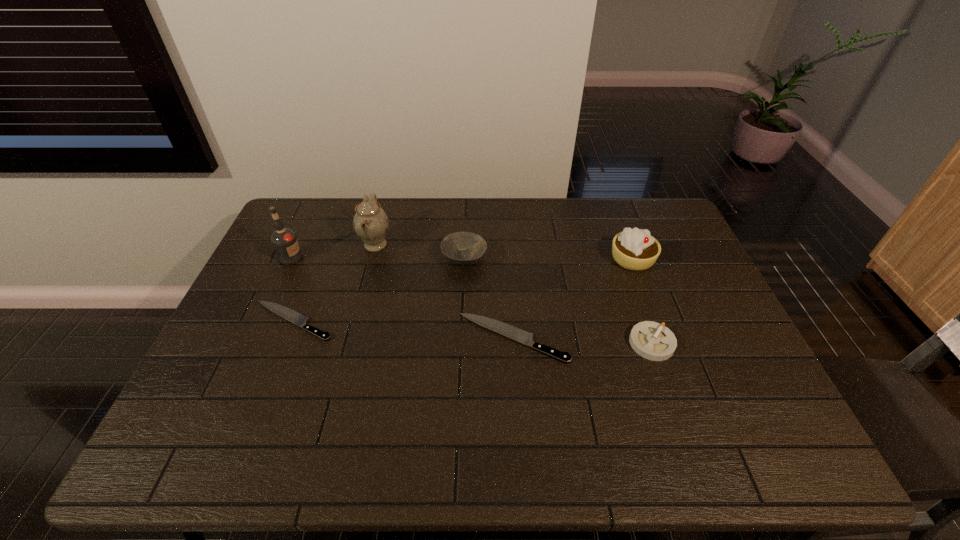
Where is `free spot between the chinaware and the bowl`? The height and width of the screenshot is (540, 960). free spot between the chinaware and the bowl is located at coordinates (420, 251).

Where is `unoccupied position between the shorter steak knife and the ashtray`? The width and height of the screenshot is (960, 540). unoccupied position between the shorter steak knife and the ashtray is located at coordinates (472, 332).

Identify the location of free space that is in between the chinaware and the vodka. The image size is (960, 540). (333, 251).

This screenshot has height=540, width=960. In order to click on object that ranks as the third closest to the right steak knife in this screenshot , I will do (635, 249).

Point out which object is positioned as the third nearest to the vodka. Please provide its 2D coordinates. Your answer should be formatted as a tuple, i.e. [(x, y)], where the tuple contains the x and y coordinates of a point satisfying the conditions above.

[(463, 248)]

Locate an element on the screen. free space that satisfies the following two spatial constraints: 1. on the front side of the fourth shortest object; 2. on the right side of the third tallest object is located at coordinates (464, 259).

Find the location of a particular element. vacant region that satisfies the following two spatial constraints: 1. on the back side of the shortest object; 2. on the front label of the vodka is located at coordinates (319, 258).

This screenshot has height=540, width=960. I want to click on vacant area that satisfies the following two spatial constraints: 1. on the back side of the whipped cream; 2. on the front label of the vodka, so [x=632, y=258].

I want to click on vacant region that satisfies the following two spatial constraints: 1. on the front label of the shortest object; 2. on the right side of the vodka, so point(261,321).

Locate an element on the screen. free location that satisfies the following two spatial constraints: 1. on the spout of the whipped cream; 2. on the left side of the chinaware is located at coordinates click(x=372, y=259).